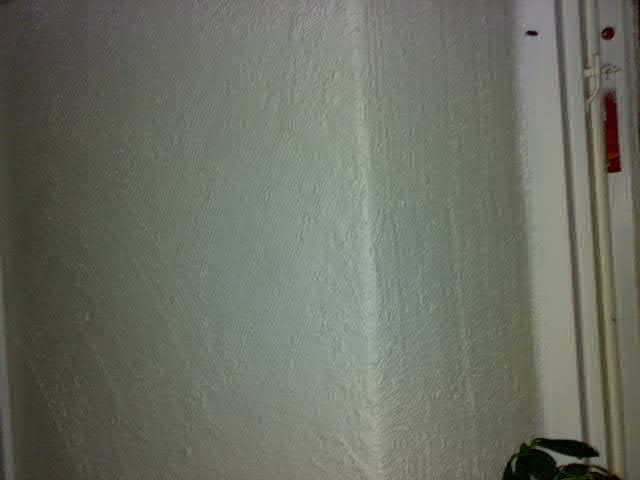
Where is `corner between the two walls`? The width and height of the screenshot is (640, 480). corner between the two walls is located at coordinates (361, 292), (361, 99).